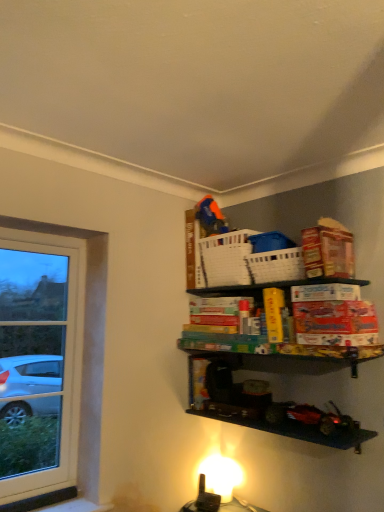
The image size is (384, 512). What do you see at coordinates (275, 266) in the screenshot?
I see `white plastic basket at upper center` at bounding box center [275, 266].

Measure the distance between white plastic basket at upper center and camera.

white plastic basket at upper center and camera are 2.07 meters apart from each other.

What is the approximate height of white plastic basket at upper center?

white plastic basket at upper center is 7.29 inches tall.

Identify the location of white plastic basket at upper center. (275, 266).

Locate an element on the screen. The image size is (384, 512). white plastic basket at upper center is located at coordinates (275, 266).